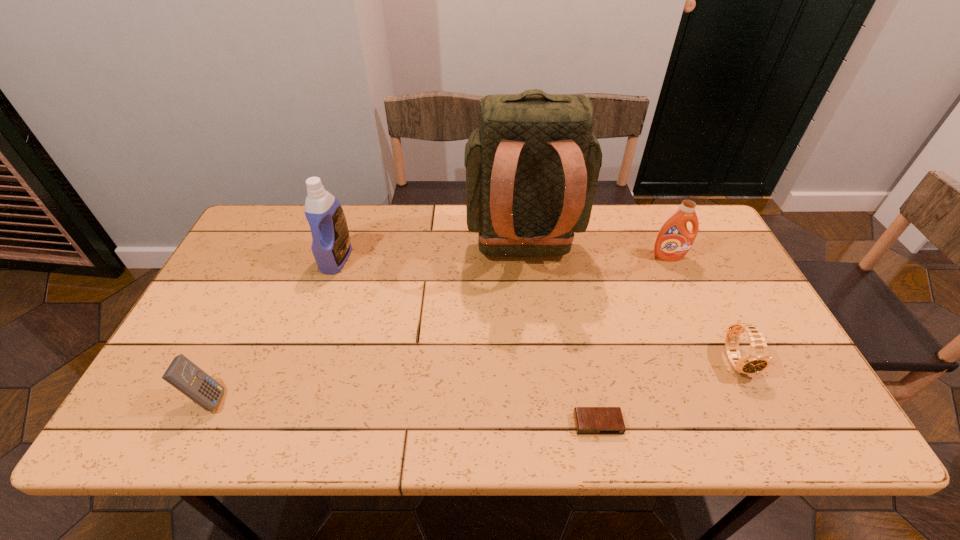
The height and width of the screenshot is (540, 960). Identify the location of vacant region that satisfies the following two spatial constraints: 1. on the face of the fifth tallest object; 2. on the front-facing side of the calculator. coord(756,399).

Find the location of a particular element. The height and width of the screenshot is (540, 960). vacant space that satisfies the following two spatial constraints: 1. on the face of the fourth farthest object; 2. on the front-facing side of the calculator is located at coordinates (756, 399).